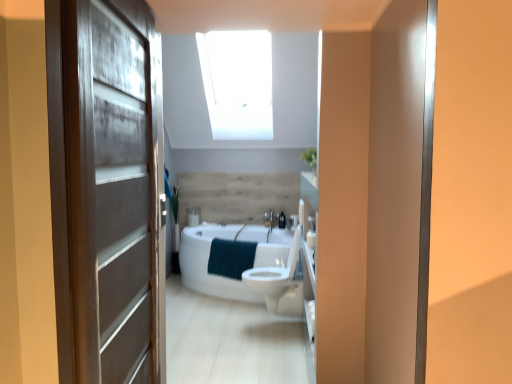
Question: Is teal soft towel at center further to camera compared to white glossy toilet at center?

Choices:
 (A) no
 (B) yes

Answer: (B)

Question: Can white glossy toilet at center be found inside teal soft towel at center?

Choices:
 (A) no
 (B) yes

Answer: (A)

Question: Is teal soft towel at center outside white glossy toilet at center?

Choices:
 (A) no
 (B) yes

Answer: (B)

Question: Is teal soft towel at center shorter than white glossy toilet at center?

Choices:
 (A) yes
 (B) no

Answer: (A)

Question: Considering the relative sizes of teal soft towel at center and white glossy toilet at center in the image provided, is teal soft towel at center thinner than white glossy toilet at center?

Choices:
 (A) yes
 (B) no

Answer: (A)

Question: From the image's perspective, is teal soft towel at center on top of white glossy toilet at center?

Choices:
 (A) no
 (B) yes

Answer: (B)

Question: From a real-world perspective, does matte brown door at left sit lower than white glossy toilet at center?

Choices:
 (A) no
 (B) yes

Answer: (A)

Question: Can you confirm if matte brown door at left is smaller than white glossy toilet at center?

Choices:
 (A) yes
 (B) no

Answer: (A)

Question: Is the position of matte brown door at left less distant than that of white glossy toilet at center?

Choices:
 (A) no
 (B) yes

Answer: (B)

Question: Is the depth of matte brown door at left greater than that of white glossy toilet at center?

Choices:
 (A) no
 (B) yes

Answer: (A)

Question: Would you consider matte brown door at left to be distant from white glossy toilet at center?

Choices:
 (A) no
 (B) yes

Answer: (B)

Question: Does matte brown door at left have a greater width compared to white glossy toilet at center?

Choices:
 (A) yes
 (B) no

Answer: (B)

Question: From a real-world perspective, is matte brown door at left on teal soft towel at center?

Choices:
 (A) no
 (B) yes

Answer: (B)